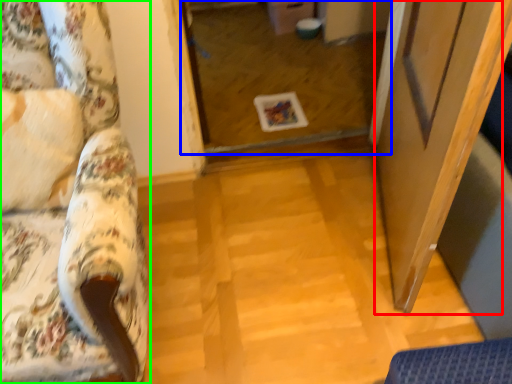
Question: Based on their relative distances, which object is farther from screen door (highlighted by a red box)? Choose from glass door (highlighted by a blue box) and furniture (highlighted by a green box).

Choices:
 (A) glass door
 (B) furniture

Answer: (A)